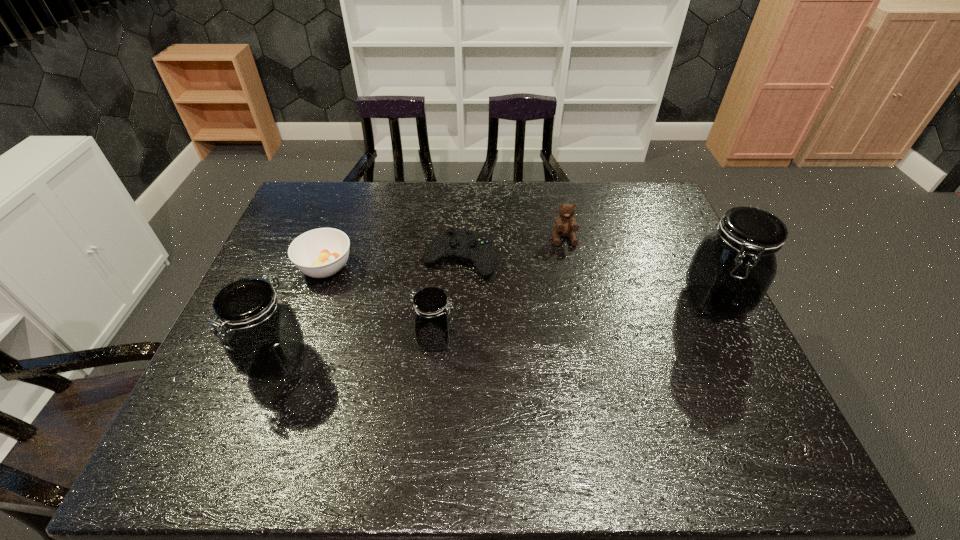
Identify the location of free space at the near edge. (516, 389).

I want to click on free spot at the left edge of the desktop, so click(x=301, y=314).

Identify the location of vacant space at the near left corner of the desktop. The height and width of the screenshot is (540, 960). (206, 389).

Find the location of a particular element. This screenshot has height=540, width=960. free point at the near right corner is located at coordinates point(725,404).

Find the location of a particular element. This screenshot has height=540, width=960. unoccupied position between the control and the soup bowl is located at coordinates (393, 263).

What are the coordinates of `free space between the fifth tallest object and the second jar from right to left` in the screenshot? It's located at (380, 303).

You are a GUI agent. You are given a task and a screenshot of the screen. Output one action in this format:
    pyautogui.click(x=<x>, y=<y>)
    Task: Click on the unoccupied area between the control and the second tallest object
    This screenshot has width=960, height=540.
    Given the screenshot: What is the action you would take?
    pyautogui.click(x=369, y=309)

Find the location of a particular element. free space between the soup bowl and the fourth shortest object is located at coordinates (380, 303).

What are the coordinates of `vacant region between the second shortest jar and the second jar from right to left` in the screenshot? It's located at pos(356,349).

You are a GUI agent. You are given a task and a screenshot of the screen. Output one action in this format:
    pyautogui.click(x=<x>, y=<y>)
    Task: Click on the unoccupied position between the fifth object from left to right and the shortest jar
    
    Given the screenshot: What is the action you would take?
    pyautogui.click(x=499, y=289)